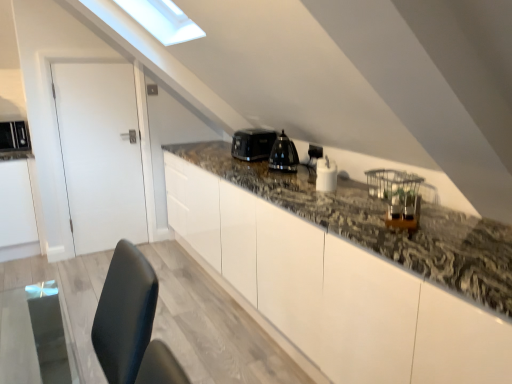
Question: Is white glossy salt shaker at center, which is counted as the fourth appliance, starting from the left, in contact with black glossy kettle at upper center, the 1th appliance in the right-to-left sequence?

Choices:
 (A) no
 (B) yes

Answer: (A)

Question: Is white glossy salt shaker at center, the first appliance viewed from the front, facing away from black glossy kettle at upper center, the 1th appliance in the right-to-left sequence?

Choices:
 (A) no
 (B) yes

Answer: (A)

Question: Does white glossy salt shaker at center, which is counted as the fourth appliance, starting from the left, have a greater width compared to black glossy kettle at upper center, which is the fifth appliance in left-to-right order?

Choices:
 (A) yes
 (B) no

Answer: (A)

Question: Is white glossy salt shaker at center, the first appliance viewed from the front, aimed at black glossy kettle at upper center, which is the fifth appliance in left-to-right order?

Choices:
 (A) yes
 (B) no

Answer: (B)

Question: Is white glossy salt shaker at center, which is the 2th appliance from right to left, at the left side of black glossy kettle at upper center, which is the fifth appliance in left-to-right order?

Choices:
 (A) yes
 (B) no

Answer: (A)

Question: Would you say black glossy kettle at center, positioned as the 3th appliance in left-to-right order, is inside or outside white glossy salt shaker at center, which is counted as the fourth appliance, starting from the left?

Choices:
 (A) outside
 (B) inside

Answer: (A)

Question: Considering the positions of black glossy kettle at center, the second appliance when ordered from front to back, and white glossy salt shaker at center, which is the 2th appliance from right to left, in the image, is black glossy kettle at center, the second appliance when ordered from front to back, bigger or smaller than white glossy salt shaker at center, which is the 2th appliance from right to left,?

Choices:
 (A) big
 (B) small

Answer: (A)

Question: Would you say black glossy kettle at center, which ranks as the 3th appliance in right-to-left order, is to the left or to the right of white glossy salt shaker at center, which is counted as the fourth appliance, starting from the left, in the picture?

Choices:
 (A) left
 (B) right

Answer: (A)

Question: In terms of width, does black glossy kettle at center, positioned as the 3th appliance in left-to-right order, look wider or thinner when compared to white glossy salt shaker at center, which is counted as the fourth appliance, starting from the left?

Choices:
 (A) thin
 (B) wide

Answer: (B)

Question: Considering their positions, is black glossy kettle at upper center, the 1th appliance in the right-to-left sequence, located in front of or behind black plastic toaster at center, positioned as the second appliance in back-to-front order?

Choices:
 (A) behind
 (B) front

Answer: (B)

Question: Is black glossy kettle at upper center, the 1th appliance in the right-to-left sequence, taller or shorter than black plastic toaster at center, the second appliance when ordered from left to right?

Choices:
 (A) short
 (B) tall

Answer: (A)

Question: Is black glossy kettle at upper center, positioned as the 3th appliance in back-to-front order, bigger or smaller than black plastic toaster at center, the 4th appliance when ordered from front to back?

Choices:
 (A) big
 (B) small

Answer: (B)

Question: In terms of width, does black glossy kettle at upper center, positioned as the 3th appliance in back-to-front order, look wider or thinner when compared to black plastic toaster at center, the 4th appliance when ordered from front to back?

Choices:
 (A) wide
 (B) thin

Answer: (B)

Question: Is matte black microwave at left, arranged as the first appliance when viewed from the left, wider or thinner than granite countertop at center?

Choices:
 (A) wide
 (B) thin

Answer: (B)

Question: From a real-world perspective, is matte black microwave at left, arranged as the first appliance when viewed from the left, positioned above or below granite countertop at center?

Choices:
 (A) above
 (B) below

Answer: (A)